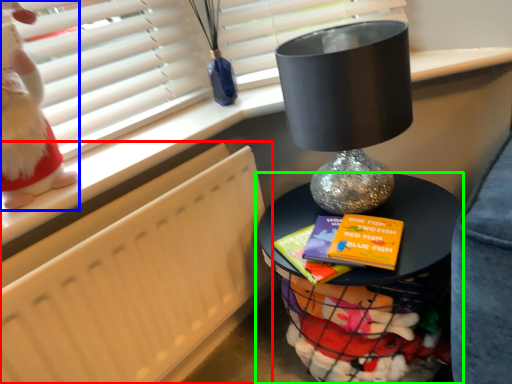
Question: Which object is the farthest from radiator (highlighted by a red box)? Choose among these: doll (highlighted by a blue box) or furniture (highlighted by a green box).

Choices:
 (A) doll
 (B) furniture

Answer: (B)